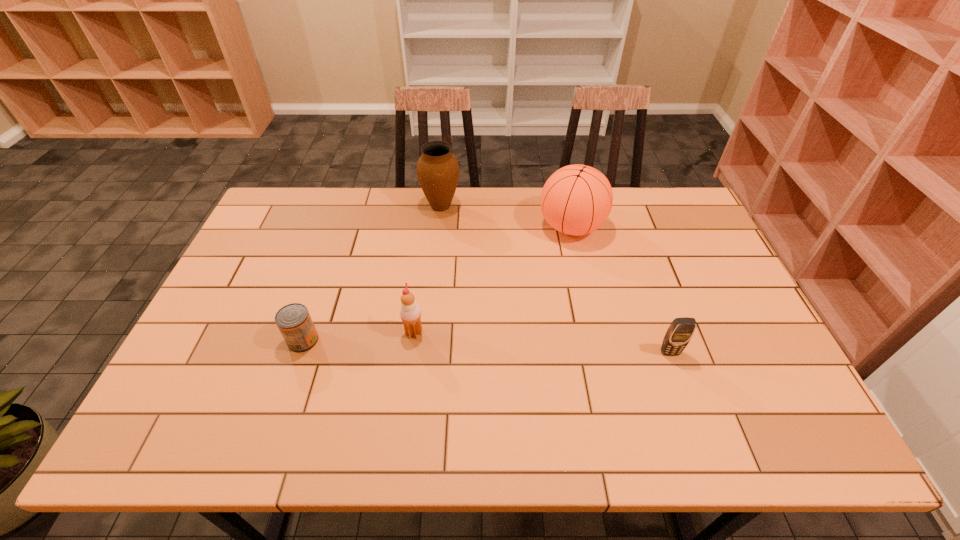
The image size is (960, 540). I want to click on free space located 0.110m on the front face of the rightmost object, so 685,396.

Find the location of a particular element. The height and width of the screenshot is (540, 960). free space located 0.060m on the left of the can is located at coordinates (265, 340).

You are a GUI agent. You are given a task and a screenshot of the screen. Output one action in this format:
    pyautogui.click(x=<x>, y=<y>)
    Task: Click on the urn situated at the far edge
    
    Given the screenshot: What is the action you would take?
    pyautogui.click(x=437, y=170)

Locate an element on the screen. The height and width of the screenshot is (540, 960). basketball present at the far edge is located at coordinates (576, 200).

The width and height of the screenshot is (960, 540). In order to click on free region at the far edge in this screenshot , I will do `click(359, 202)`.

Where is `vacant space at the near edge`? The height and width of the screenshot is (540, 960). vacant space at the near edge is located at coordinates (370, 418).

In the image, there is a desktop. Where is `vacant region at the left edge`? This screenshot has height=540, width=960. vacant region at the left edge is located at coordinates (279, 268).

This screenshot has width=960, height=540. What are the coordinates of `vacant space at the right edge` in the screenshot? It's located at (754, 376).

Identify the location of free space at the near left corner of the desktop. The image size is (960, 540). (206, 448).

In the image, there is a desktop. Identify the location of free space at the near right corner. The width and height of the screenshot is (960, 540). (811, 446).